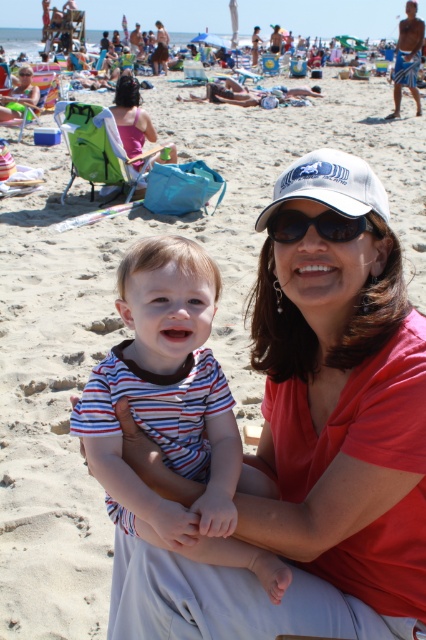
Question: Does black plastic sunglasses at center appear over matte black sunglasses at upper left?

Choices:
 (A) no
 (B) yes

Answer: (A)

Question: Which is nearer to the matte black sunglasses at upper left?

Choices:
 (A) black plastic sunglasses at center
 (B) pink fabric chair at upper left
 (C) white mesh baseball cap at center
 (D) striped cotton shirt at center

Answer: (B)

Question: Is white mesh baseball cap at center further to camera compared to black plastic sunglasses at center?

Choices:
 (A) yes
 (B) no

Answer: (B)

Question: Which point appears farthest from the camera in this image?

Choices:
 (A) (305, 220)
 (B) (117, 97)
 (C) (141, 275)

Answer: (B)

Question: Can you confirm if striped cotton shirt at center is thinner than matte black sunglasses at upper left?

Choices:
 (A) no
 (B) yes

Answer: (B)

Question: Which point appears closest to the camera in this image?

Choices:
 (A) (227, 458)
 (B) (123, 120)
 (C) (5, 116)
 (D) (368, 227)

Answer: (D)